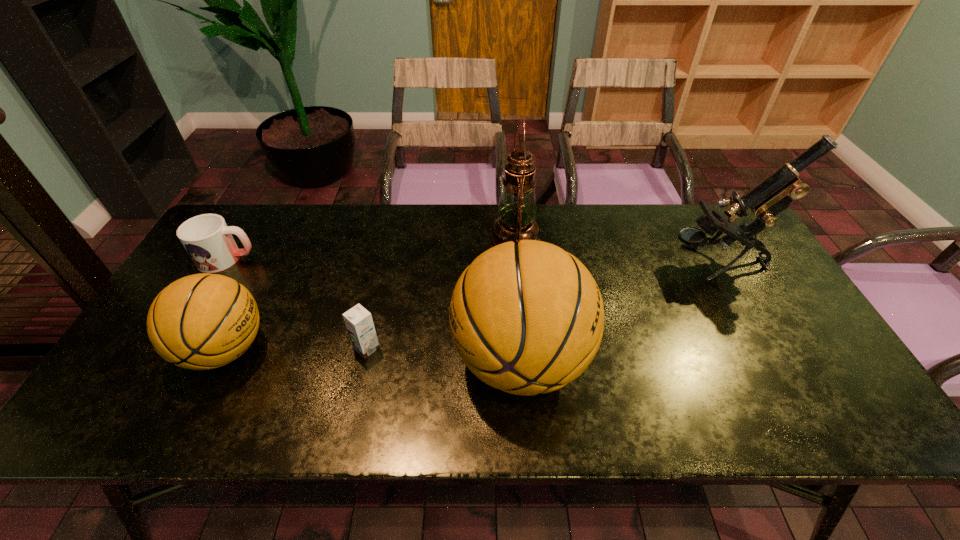
I want to click on the fourth tallest object, so click(204, 321).

Identify the location of the shorter basketball. The width and height of the screenshot is (960, 540). (204, 321).

Locate an element on the screen. The height and width of the screenshot is (540, 960). the fourth shortest object is located at coordinates (526, 318).

Identify the location of the right basketball. The image size is (960, 540). (526, 318).

The height and width of the screenshot is (540, 960). I want to click on oil lamp, so click(x=516, y=210).

Locate an element on the screen. mug is located at coordinates (208, 240).

This screenshot has height=540, width=960. Identify the location of chocolate milk. (359, 322).

At what (x,y) coordinates should I click in order to perform the action: click on the rightmost object. Please return your answer as a coordinate pair (x, y). Image resolution: width=960 pixels, height=540 pixels. Looking at the image, I should click on click(x=771, y=196).

Identify the location of free space located 0.170m on the surface of the third shortest object near the brand logo. point(338,349).

At what (x,y) coordinates should I click in order to perform the action: click on free location located on the surface of the fourth shortest object near the brand logo. Please return your answer as a coordinate pair (x, y). This screenshot has width=960, height=540. Looking at the image, I should click on (366, 360).